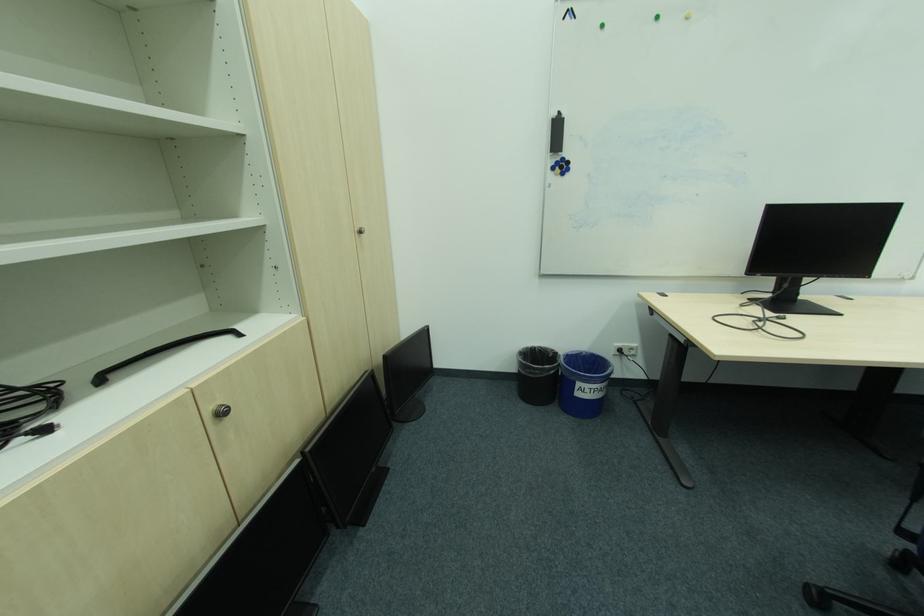
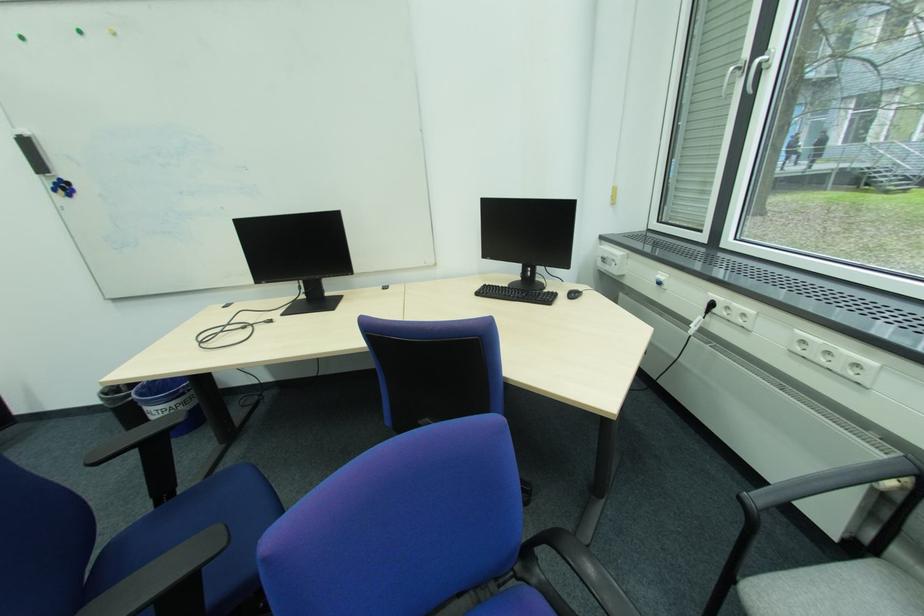
Question: In a continuous first-person perspective shot, in which direction is the camera moving?

Choices:
 (A) Left
 (B) Right
 (C) Forward
 (D) Backward

Answer: (B)